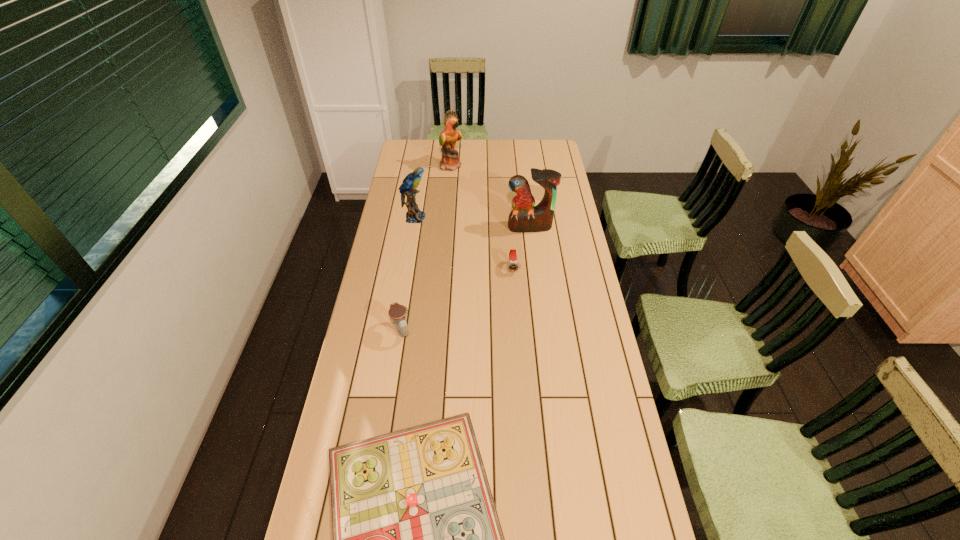
You are a GUI agent. You are given a task and a screenshot of the screen. Output one action in this format:
    pyautogui.click(x=<x>, y=<y>)
    Task: Click on the empty location between the leftmost parrot and the rightmost parrot
    
    Given the screenshot: What is the action you would take?
    pyautogui.click(x=472, y=222)

You are a GUI agent. You are given a task and a screenshot of the screen. Output one action in this format:
    pyautogui.click(x=<x>, y=<y>)
    Task: Click on the free space between the rightmost parrot and the second parrot from right to left
    
    Given the screenshot: What is the action you would take?
    pyautogui.click(x=491, y=196)

Identify the location of free space between the fourth tallest object and the farther watch. The width and height of the screenshot is (960, 540). (457, 299).

Image resolution: width=960 pixels, height=540 pixels. What are the coordinates of `free space between the left watch and the farthest object` in the screenshot? It's located at [426, 248].

Where is `empty location between the rightmost parrot and the leftmost parrot`? Image resolution: width=960 pixels, height=540 pixels. empty location between the rightmost parrot and the leftmost parrot is located at coordinates (472, 222).

The width and height of the screenshot is (960, 540). In order to click on free space between the third nearest object and the farthest parrot in this screenshot , I will do (x=482, y=217).

I want to click on vacant point located between the right watch and the leftmost parrot, so click(464, 242).

Identify which object is located as the fourth nearest to the fifth farthest object. Please provide its 2D coordinates. Your answer should be formatted as a tuple, i.e. [(x, y)], where the tuple contains the x and y coordinates of a point satisfying the conditions above.

[(525, 217)]

At what (x,y) coordinates should I click in order to perform the action: click on object that stands as the fifth closest to the leftmost parrot. Please return your answer as a coordinate pair (x, y). This screenshot has height=540, width=960. Looking at the image, I should click on (417, 539).

Identify which parrot is the second nearest to the rightmost parrot. Please provide its 2D coordinates. Your answer should be formatted as a tuple, i.e. [(x, y)], where the tuple contains the x and y coordinates of a point satisfying the conditions above.

[(450, 161)]